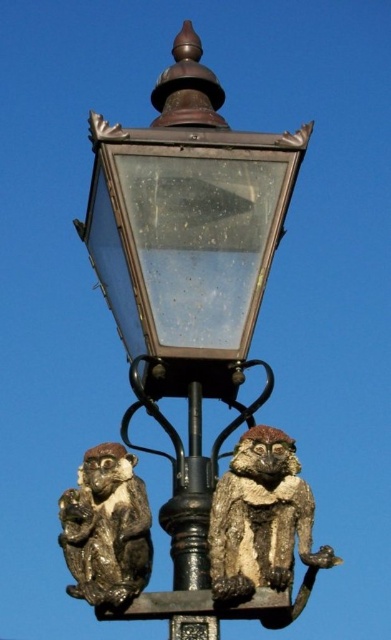
Who is positioned more to the right, bronze glass street light at center or bronze textured monkey at lower left?

bronze glass street light at center is more to the right.

Which is below, bronze glass street light at center or bronze textured monkey at lower left?

bronze textured monkey at lower left

This screenshot has width=391, height=640. Describe the element at coordinates (188, 266) in the screenshot. I see `bronze glass street light at center` at that location.

You are a GUI agent. You are given a task and a screenshot of the screen. Output one action in this format:
    pyautogui.click(x=<x>, y=<y>)
    Task: Click on the bronze glass street light at center
    The height and width of the screenshot is (640, 391).
    Given the screenshot: What is the action you would take?
    pyautogui.click(x=188, y=266)

Is rusty metal monkey at lower right closer to camera compared to black metal pole at center?

Yes, it is.

In the scene shown: Who is higher up, rusty metal monkey at lower right or black metal pole at center?

black metal pole at center is higher up.

Locate an element on the screen. The width and height of the screenshot is (391, 640). rusty metal monkey at lower right is located at coordinates (263, 524).

Can you confirm if bronze glass street light at center is smaller than rusty metal monkey at lower right?

Incorrect, bronze glass street light at center is not smaller in size than rusty metal monkey at lower right.

Does bronze glass street light at center have a lesser width compared to rusty metal monkey at lower right?

No.

Between point (165, 147) and point (295, 525), which one is positioned in front?

Point (295, 525) is in front.

This screenshot has width=391, height=640. Find the location of `bronze glass street light at center`. bronze glass street light at center is located at coordinates point(188,266).